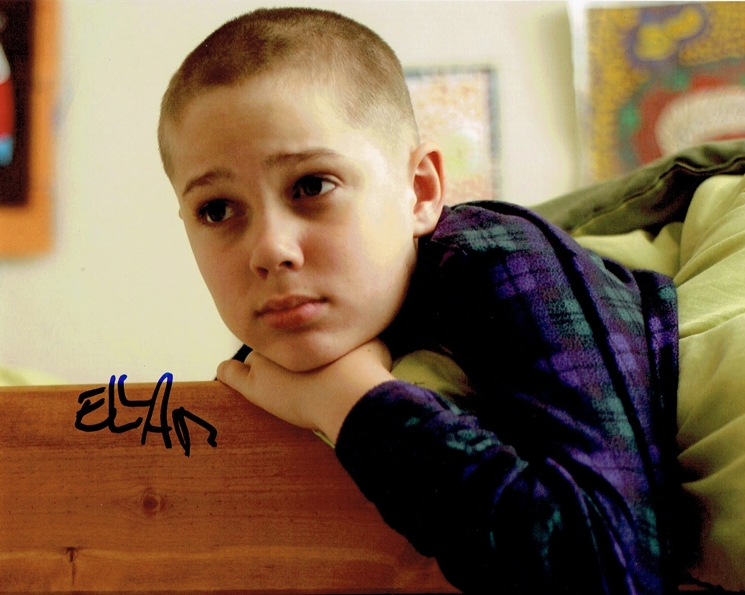
You are a GUI agent. You are given a task and a screenshot of the screen. Output one action in this format:
    pyautogui.click(x=<x>, y=<y>)
    Task: Click on the wall
    The width and height of the screenshot is (745, 595).
    Given the screenshot: What is the action you would take?
    pyautogui.click(x=117, y=216)